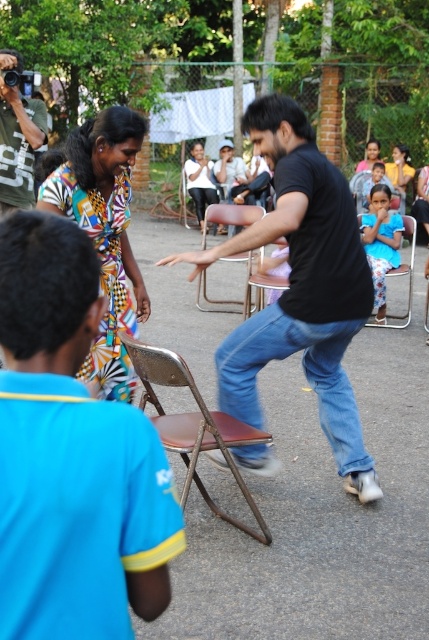
Based on the photo, can you confirm if brown leather chair at center is shorter than green textured shirt at upper left?

Correct, brown leather chair at center is not as tall as green textured shirt at upper left.

Between point (208, 436) and point (33, 131), which one is positioned behind?

The point (33, 131) is behind.

Locate an element on the screen. This screenshot has height=640, width=429. brown leather chair at center is located at coordinates (193, 426).

Who is taller, blue fabric shirt at upper left or green textured shirt at upper left?

green textured shirt at upper left is taller.

Who is shorter, blue fabric shirt at upper left or green textured shirt at upper left?

Standing shorter between the two is blue fabric shirt at upper left.

Between point (11, 417) and point (41, 113), which one is positioned behind?

Point (41, 113)

The image size is (429, 640). Find the location of `blue fabric shirt at upper left`. blue fabric shirt at upper left is located at coordinates (72, 456).

Does black matte shirt at center have a smaller size compared to metallic brown chair at center?

Incorrect, black matte shirt at center is not smaller in size than metallic brown chair at center.

Is black matte shirt at center positioned behind metallic brown chair at center?

Answer: No, it is in front of metallic brown chair at center.

Who is more distant from viewer, (265,124) or (199,289)?

The point (199,289) is more distant.

You are a GUI agent. You are given a task and a screenshot of the screen. Output one action in this format:
    pyautogui.click(x=<x>, y=<y>)
    Task: Click on the black matte shirt at center
    This screenshot has width=429, height=640.
    Given the screenshot: What is the action you would take?
    click(x=301, y=288)